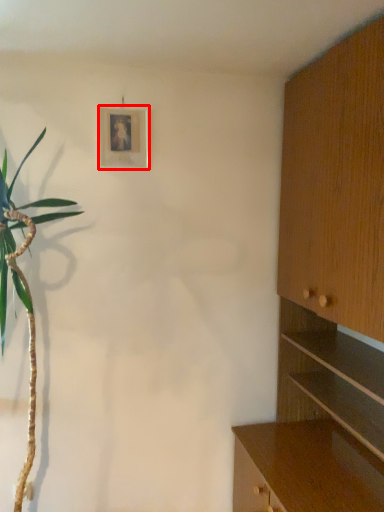
Question: From the image's perspective, what is the correct spatial relationship of picture frame (annotated by the red box) in relation to cabinetry?

Choices:
 (A) below
 (B) above

Answer: (B)